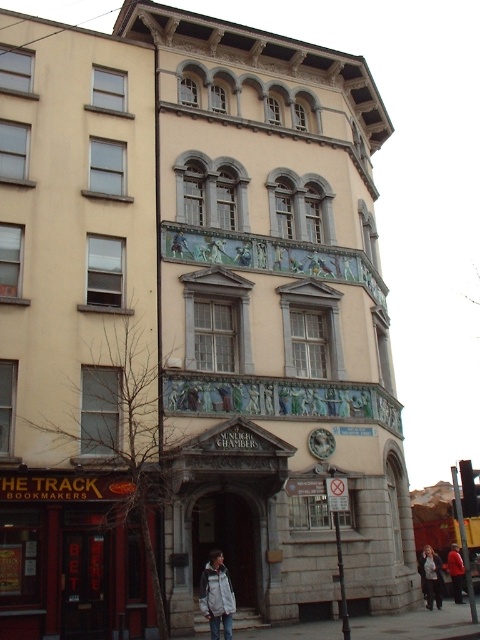
Is point (428, 557) behind point (459, 579)?

That is False.

Can you confirm if white cotton jacket at lower center is taller than red jacket at center?

No.

What do you see at coordinates (432, 577) in the screenshot? The image size is (480, 640). I see `white cotton jacket at lower center` at bounding box center [432, 577].

Find the location of a particular element. Image resolution: width=480 pixels, height=640 pixels. white cotton jacket at lower center is located at coordinates (432, 577).

Does white fleece jacket at center have a smaller size compared to white cotton jacket at lower center?

Yes.

Which is below, white fleece jacket at center or white cotton jacket at lower center?

Positioned lower is white cotton jacket at lower center.

Which is behind, point (208, 588) or point (439, 580)?

Positioned behind is point (439, 580).

Locate an element on the screen. The image size is (480, 640). white fleece jacket at center is located at coordinates (216, 595).

Between white fleece jacket at center and red jacket at center, which one appears on the right side from the viewer's perspective?

red jacket at center is more to the right.

Image resolution: width=480 pixels, height=640 pixels. In order to click on white fleece jacket at center in this screenshot , I will do `click(216, 595)`.

You are a GUI agent. You are given a task and a screenshot of the screen. Output one action in this format:
    pyautogui.click(x=<x>, y=<y>)
    Task: Click on the white fleece jacket at center
    
    Given the screenshot: What is the action you would take?
    pyautogui.click(x=216, y=595)